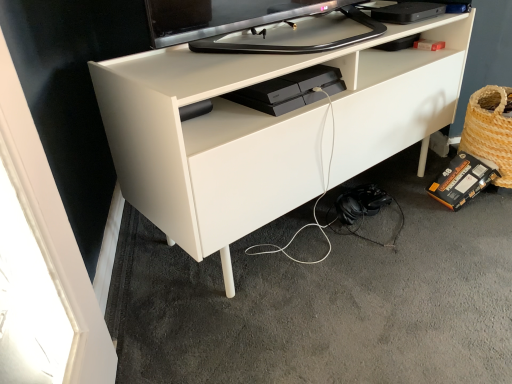
Question: Considering the positions of black matte headphones at lower right and white matte desk at center in the image, is black matte headphones at lower right bigger or smaller than white matte desk at center?

Choices:
 (A) big
 (B) small

Answer: (B)

Question: Relative to white matte desk at center, is black matte headphones at lower right in front or behind?

Choices:
 (A) front
 (B) behind

Answer: (B)

Question: Considering the real-world distances, which object is closest to the black plastic gaming console at center, the 1th equipment when ordered from front to back?

Choices:
 (A) black matte headphones at lower right
 (B) white matte desk at center
 (C) woven straw basket at lower right
 (D) black cardboard box at lower right, the 2th equipment positioned from the front

Answer: (B)

Question: Considering the real-world distances, which object is farthest from the white matte desk at center?

Choices:
 (A) black cardboard box at lower right, the 1th equipment when ordered from back to front
 (B) woven straw basket at lower right
 (C) black plastic gaming console at center, the second equipment when ordered from right to left
 (D) black matte headphones at lower right

Answer: (A)